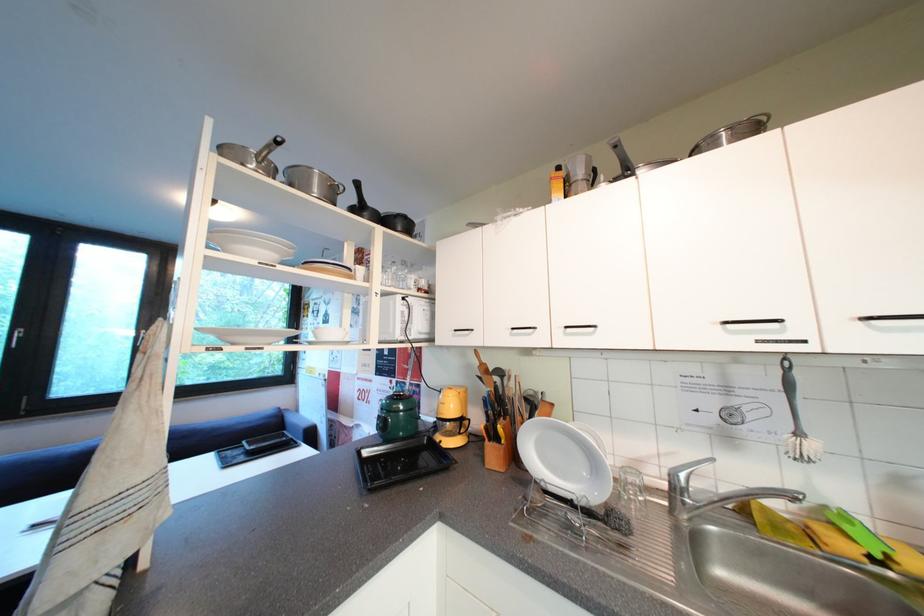
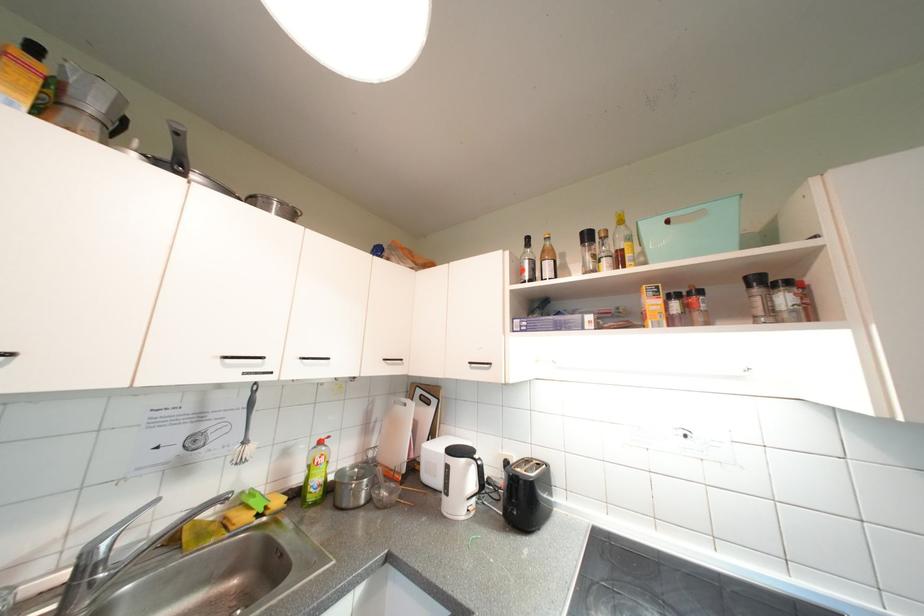
Question: The camera is either moving clockwise (left) or counter-clockwise (right) around the object. The first image is from the beginning of the video and the second image is from the end. Is the camera moving left or right when shooting the video?

Choices:
 (A) Left
 (B) Right

Answer: (A)